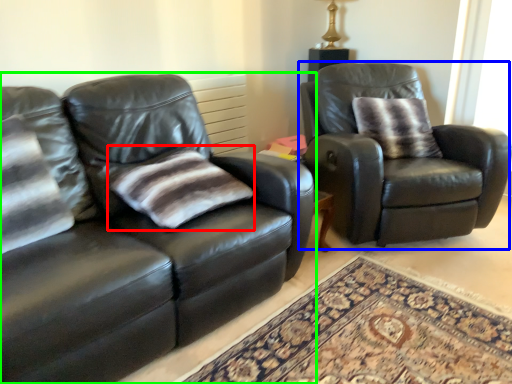
Question: Estimate the real-world distances between objects in this image. Which object is closer to pillow (highlighted by a red box), chair (highlighted by a blue box) or studio couch (highlighted by a green box)?

Choices:
 (A) chair
 (B) studio couch

Answer: (B)